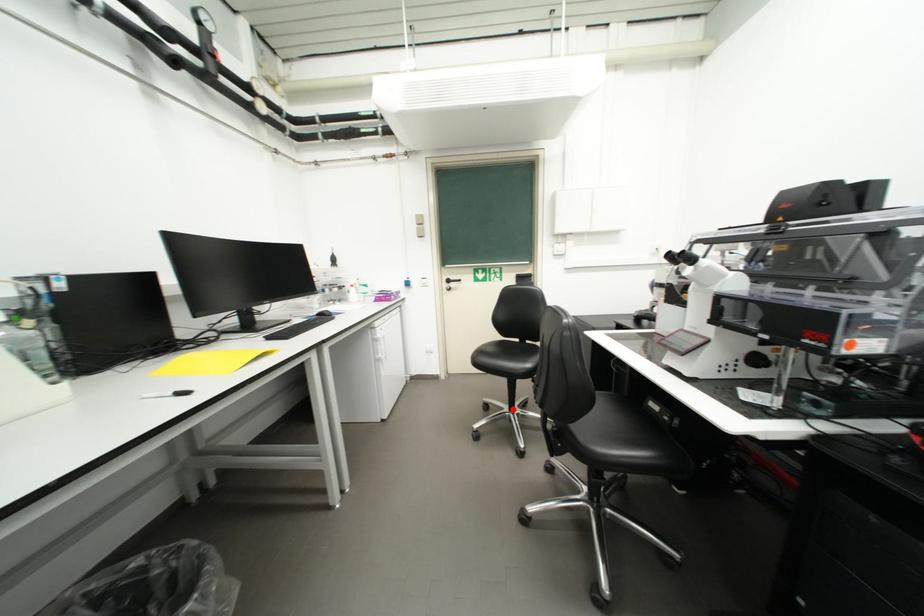
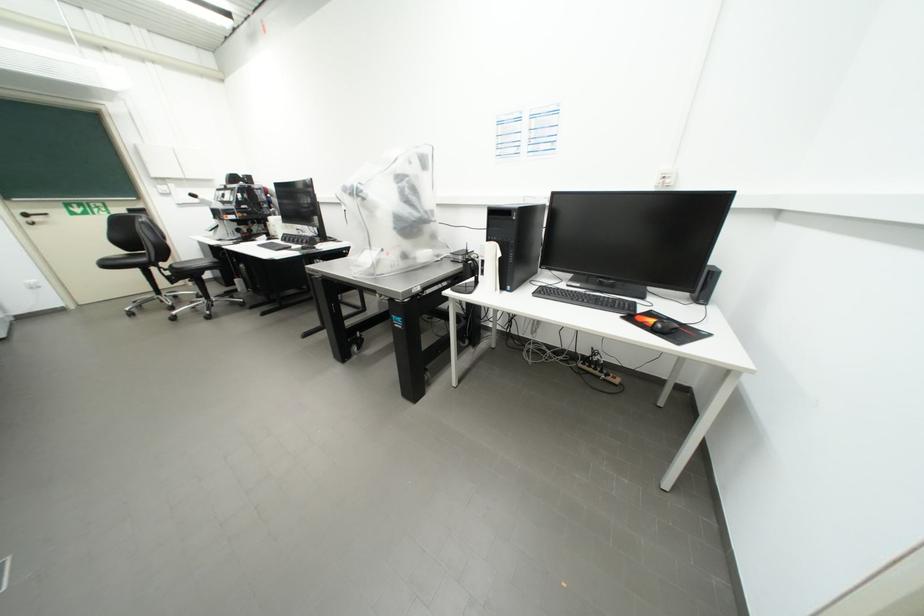
Question: I am providing you with two images of the same scene from different viewpoints. In image1, a red point is highlighted. Considering the same 3D point in image2, which of the following is correct?

Choices:
 (A) It is closer
 (B) It is farther

Answer: (A)